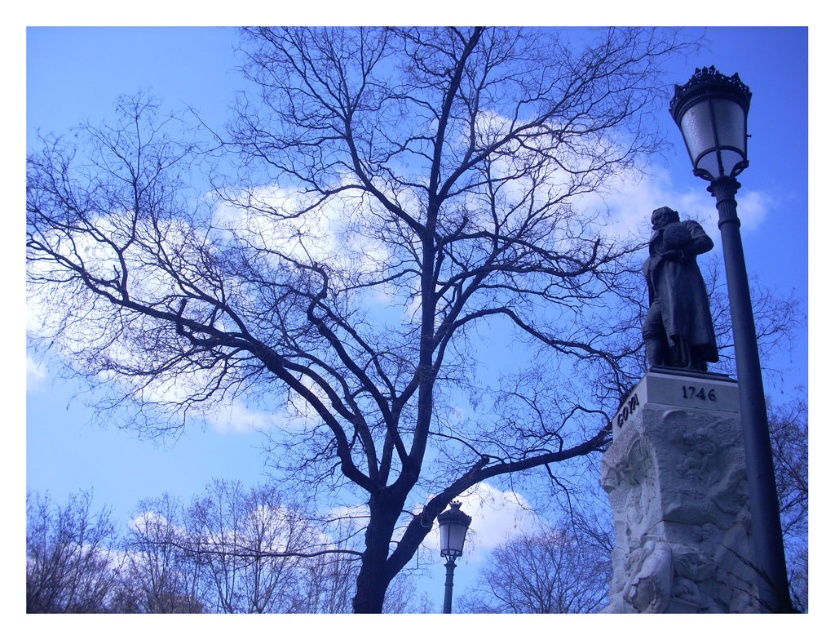
Is bare branches at lower left shorter than bronze statue at upper right?

In fact, bare branches at lower left may be taller than bronze statue at upper right.

Between point (84, 509) and point (656, 307), which one is positioned in front?

Positioned in front is point (656, 307).

Between point (64, 609) and point (684, 244), which one is positioned behind?

The point (64, 609) is behind.

Find the location of a particular element. The height and width of the screenshot is (640, 835). bare branches at lower left is located at coordinates (68, 556).

Is bronze statue at upper right bigger than metallic streetlight at center?

No.

Which is below, bronze statue at upper right or metallic streetlight at center?

metallic streetlight at center is lower down.

Which is in front, point (706, 356) or point (443, 524)?

Point (706, 356) is in front.

Locate an element on the screen. The width and height of the screenshot is (835, 640). bronze statue at upper right is located at coordinates (676, 296).

Does polished brass street light at right have a lesser height compared to bare branches at center?

In fact, polished brass street light at right may be taller than bare branches at center.

Which of these two, polished brass street light at right or bare branches at center, stands taller?

With more height is polished brass street light at right.

Is point (682, 84) positioned behind point (583, 579)?

No, (682, 84) is closer to viewer.

The width and height of the screenshot is (835, 640). In order to click on polished brass street light at right in this screenshot , I will do `click(736, 298)`.